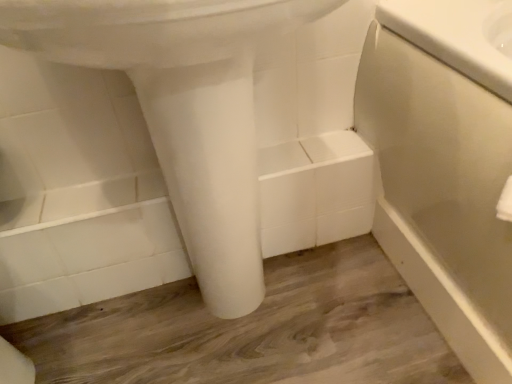
What do you see at coordinates (183, 109) in the screenshot? I see `white glossy sink at center` at bounding box center [183, 109].

Find the location of `white glossy sink at center`. white glossy sink at center is located at coordinates (183, 109).

In order to face white glossy sink at center, should I rotate leftwards or rightwards?

To align with it, rotate left about 5.155°.

Image resolution: width=512 pixels, height=384 pixels. What are the coordinates of `white glossy sink at center` in the screenshot? It's located at (183, 109).